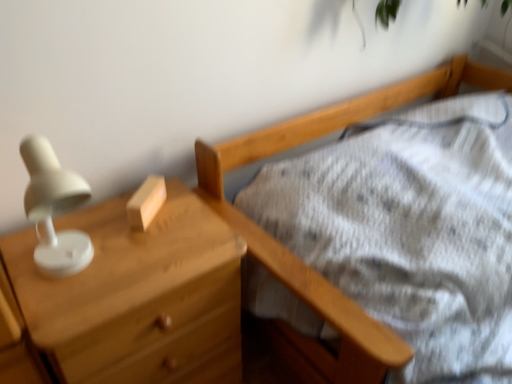
Identify the location of blank space above matte wood chest of drawers at left (from a real-world perspective). (128, 251).